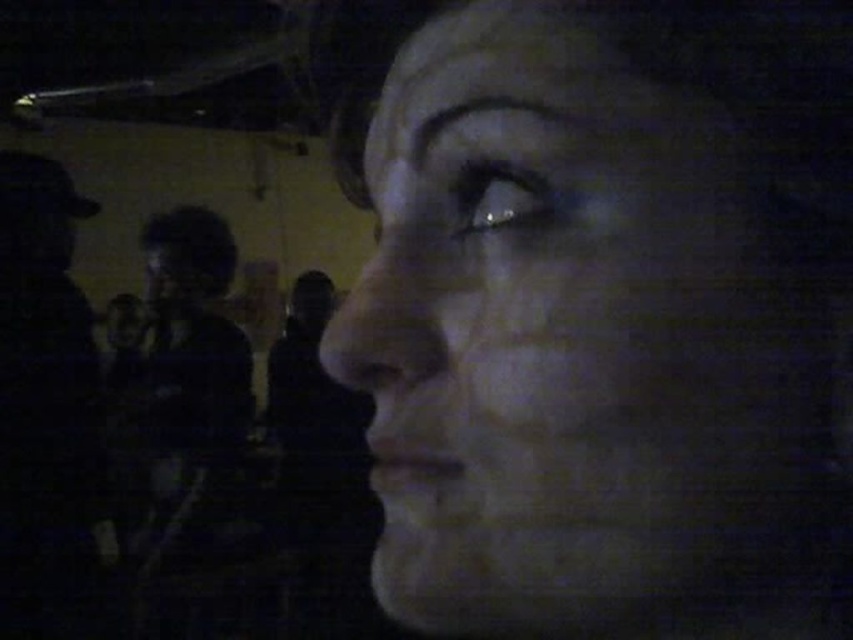
Is dark matte jacket at left shorter than dark gray fabric shirt at left?

Correct, dark matte jacket at left is not as tall as dark gray fabric shirt at left.

Between point (28, 636) and point (141, 580), which one is positioned in front?

Positioned in front is point (28, 636).

Between point (36, 280) and point (158, 388), which one is positioned in front?

Positioned in front is point (36, 280).

Image resolution: width=853 pixels, height=640 pixels. Identify the location of dark matte jacket at left. (45, 410).

Which is below, smooth stone face at center or dark matte jacket at left?

dark matte jacket at left is lower down.

Can you confirm if smooth stone face at center is taller than dark matte jacket at left?

No, smooth stone face at center is not taller than dark matte jacket at left.

Which is behind, point (351, 298) or point (39, 269)?

Point (39, 269)

At what (x,y) coordinates should I click in order to perform the action: click on smooth stone face at center. Please return your answer as a coordinate pair (x, y). This screenshot has width=853, height=640. Looking at the image, I should click on (554, 333).

Does smooth stone face at center have a greater width compared to dark gray fabric shirt at left?

No.

Between point (622, 541) and point (206, 524), which one is positioned in front?

Point (622, 541)

The width and height of the screenshot is (853, 640). What do you see at coordinates (554, 333) in the screenshot?
I see `smooth stone face at center` at bounding box center [554, 333].

You are a GUI agent. You are given a task and a screenshot of the screen. Output one action in this format:
    pyautogui.click(x=<x>, y=<y>)
    Task: Click on the smooth stone face at center
    The image size is (853, 640).
    Given the screenshot: What is the action you would take?
    pyautogui.click(x=554, y=333)